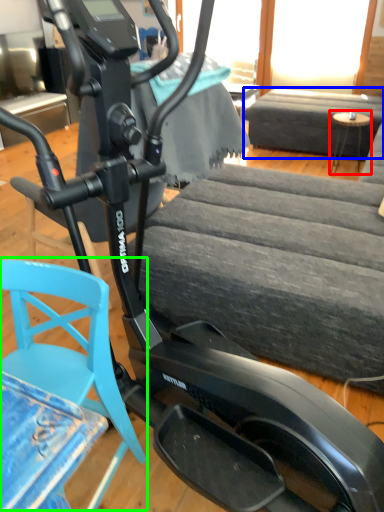
Question: Estimate the real-world distances between objects in this image. Which object is closer to table (highlighted by a red box), couch (highlighted by a blue box) or swivel chair (highlighted by a green box)?

Choices:
 (A) couch
 (B) swivel chair

Answer: (A)